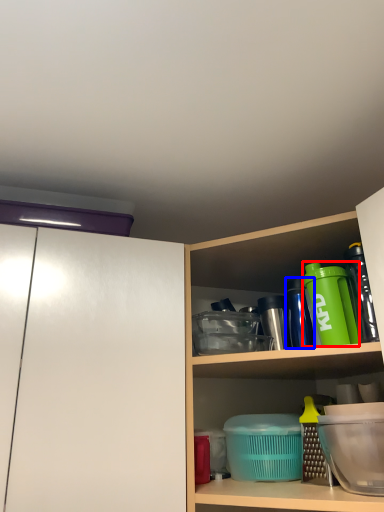
Question: Which point is further to the camera, bottle (highlighted by a red box) or bottle (highlighted by a blue box)?

Choices:
 (A) bottle
 (B) bottle

Answer: (B)